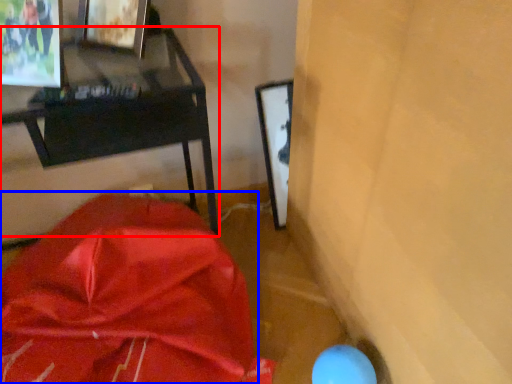
Question: Which point is closer to the camera, furniture (highlighted by a red box) or wrap (highlighted by a blue box)?

Choices:
 (A) furniture
 (B) wrap

Answer: (B)